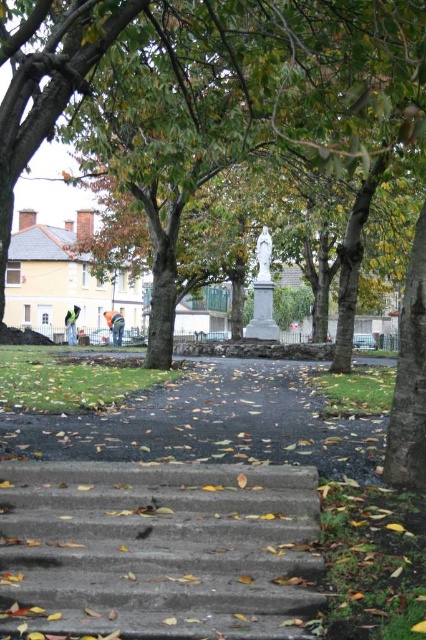
Does point (236, 44) come in front of point (121, 593)?

No, (236, 44) is behind (121, 593).

Is point (357, 52) more distant than point (190, 557)?

Yes, it is behind point (190, 557).

You are a GUI agent. You are given a task and a screenshot of the screen. Output one action in this format:
    pyautogui.click(x=<x>, y=<y>)
    Task: Click on the brown leafy tree at center
    The height and width of the screenshot is (640, 426).
    Given the screenshot: What is the action you would take?
    pyautogui.click(x=215, y=88)